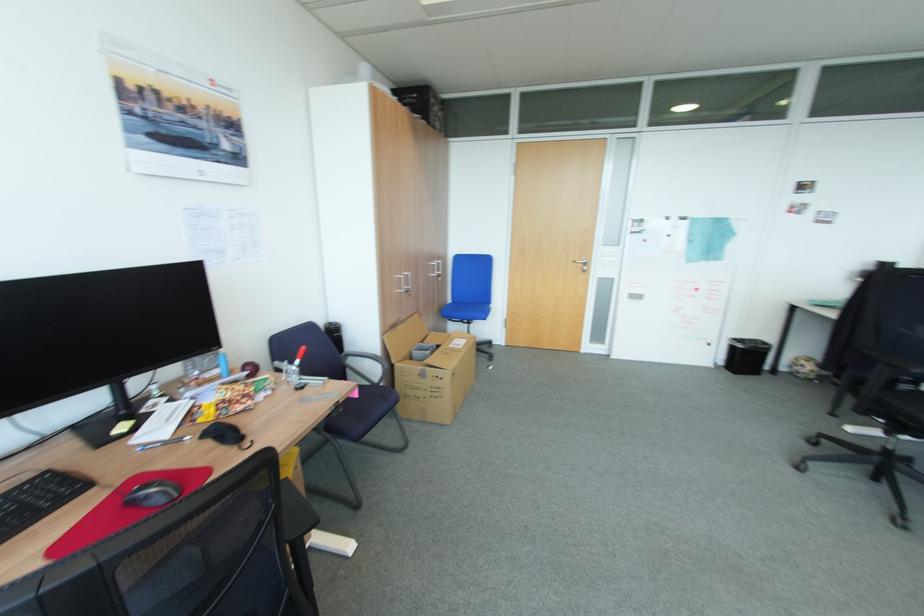
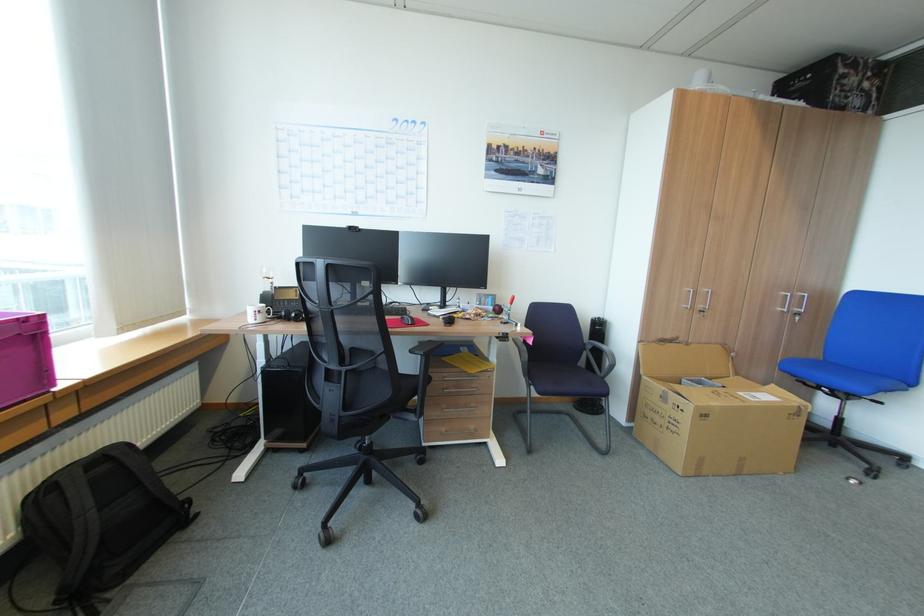
The point at (448, 317) is marked in the first image. Where is the corresponding point in the second image?

(786, 370)